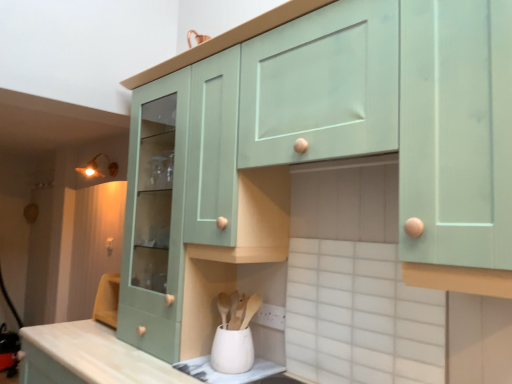
Question: Is the depth of white matte utensil holder at lower center greater than that of matte brass light fixture at upper left?

Choices:
 (A) yes
 (B) no

Answer: (B)

Question: Is white matte utensil holder at lower center beside matte brass light fixture at upper left?

Choices:
 (A) yes
 (B) no

Answer: (B)

Question: Considering the relative sizes of white matte utensil holder at lower center and matte brass light fixture at upper left in the image provided, is white matte utensil holder at lower center smaller than matte brass light fixture at upper left?

Choices:
 (A) yes
 (B) no

Answer: (A)

Question: From the image's perspective, is white matte utensil holder at lower center under matte brass light fixture at upper left?

Choices:
 (A) yes
 (B) no

Answer: (A)

Question: Is white matte utensil holder at lower center thinner than matte brass light fixture at upper left?

Choices:
 (A) yes
 (B) no

Answer: (A)

Question: Choose the correct answer: Is mint green wood cabinet at upper center, acting as the 1th cabinetry starting from the right, inside white matte utensil holder at lower center or outside it?

Choices:
 (A) inside
 (B) outside

Answer: (B)

Question: Based on their positions, is mint green wood cabinet at upper center, the second cabinetry viewed from the left, located to the left or right of white matte utensil holder at lower center?

Choices:
 (A) left
 (B) right

Answer: (B)

Question: From their relative heights in the image, would you say mint green wood cabinet at upper center, the second cabinetry viewed from the left, is taller or shorter than white matte utensil holder at lower center?

Choices:
 (A) short
 (B) tall

Answer: (B)

Question: From a real-world perspective, relative to white matte utensil holder at lower center, is mint green wood cabinet at upper center, acting as the 1th cabinetry starting from the right, vertically above or below?

Choices:
 (A) above
 (B) below

Answer: (A)

Question: From a real-world perspective, is white matte utensil holder at lower center positioned above or below mint green wood cabinet at upper center, the second cabinetry viewed from the left?

Choices:
 (A) above
 (B) below

Answer: (B)

Question: Considering the positions of point (234, 364) and point (278, 236), is point (234, 364) closer or farther from the camera than point (278, 236)?

Choices:
 (A) farther
 (B) closer

Answer: (B)

Question: From the image's perspective, is white matte utensil holder at lower center located above or below mint green wood cabinet at upper center, acting as the 1th cabinetry starting from the right?

Choices:
 (A) above
 (B) below

Answer: (B)

Question: Is white matte utensil holder at lower center wider or thinner than mint green wood cabinet at upper center, acting as the 1th cabinetry starting from the right?

Choices:
 (A) thin
 (B) wide

Answer: (A)

Question: In the image, is matte brass light fixture at upper left positioned in front of or behind white ceramic tile at lower center?

Choices:
 (A) behind
 (B) front

Answer: (A)

Question: From a real-world perspective, is matte brass light fixture at upper left positioned above or below white ceramic tile at lower center?

Choices:
 (A) below
 (B) above

Answer: (B)